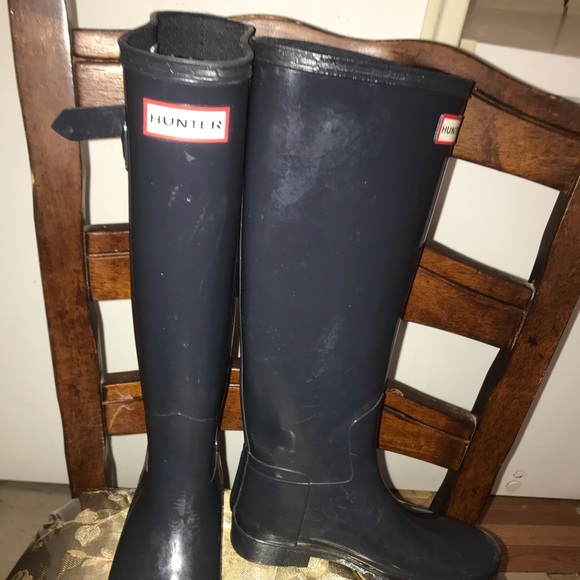
Identify the location of hardwood floor. The width and height of the screenshot is (580, 580). (521, 518).